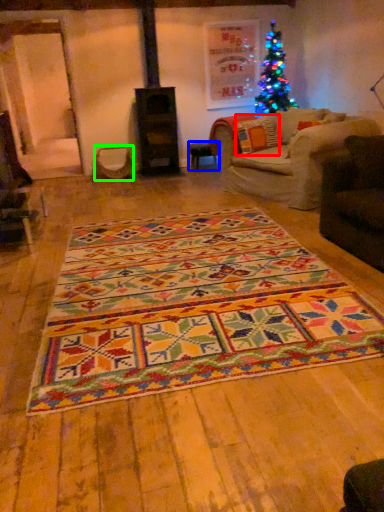
Question: Estimate the real-world distances between objects in this image. Which object is closer to pillow (highlighted by a red box), table (highlighted by a blue box) or swivel chair (highlighted by a green box)?

Choices:
 (A) table
 (B) swivel chair

Answer: (A)